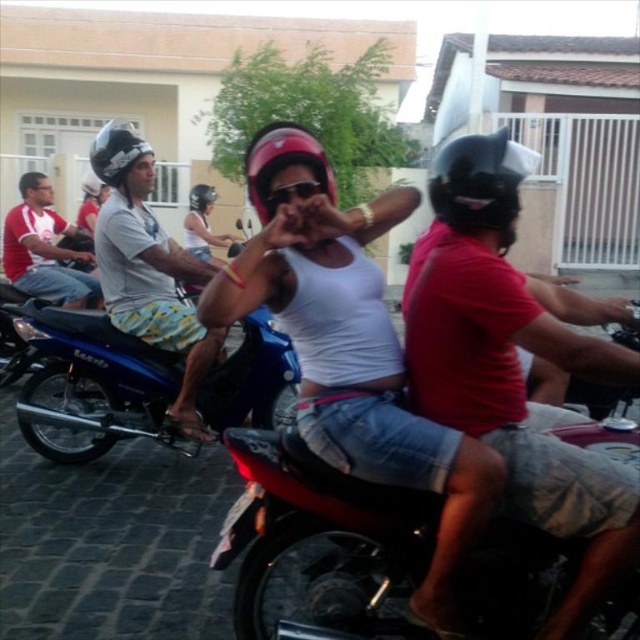
Who is positioned more to the right, pink matte helmet at center or brushed metal helmet at center?

From the viewer's perspective, pink matte helmet at center appears more on the right side.

Locate an element on the screen. This screenshot has height=640, width=640. pink matte helmet at center is located at coordinates (282, 163).

The width and height of the screenshot is (640, 640). What do you see at coordinates (282, 163) in the screenshot?
I see `pink matte helmet at center` at bounding box center [282, 163].

Find the location of `pink matte helmet at center`. pink matte helmet at center is located at coordinates (282, 163).

Image resolution: width=640 pixels, height=640 pixels. I want to click on white matte tank top at center, so click(353, 353).

Between point (333, 275) and point (97, 218), which one is positioned behind?

The point (97, 218) is behind.

Where is `white matte tank top at center`? The height and width of the screenshot is (640, 640). white matte tank top at center is located at coordinates (353, 353).

Locate an element on the screen. Image resolution: width=640 pixels, height=640 pixels. white matte tank top at center is located at coordinates (x=353, y=353).

Who is more distant from viewer, (198, 209) or (90, 189)?

The point (198, 209) is more distant.

Which is behind, point (208, 193) or point (104, 186)?

The point (208, 193) is behind.

Find the location of `brushed metal helmet at center`. brushed metal helmet at center is located at coordinates (202, 196).